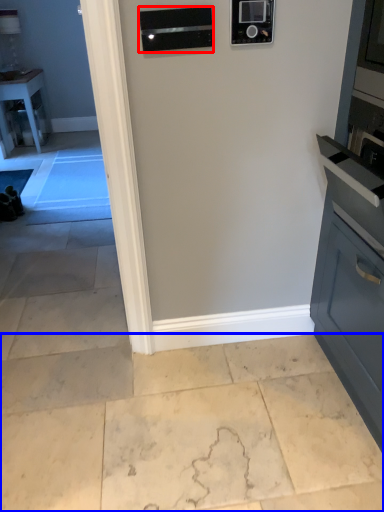
Question: Among these objects, which one is nearest to the camera, appliance (highlighted by a red box) or concrete (highlighted by a blue box)?

Choices:
 (A) appliance
 (B) concrete

Answer: (B)